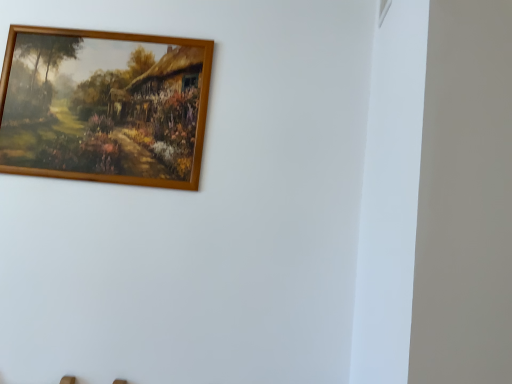
Question: From a real-world perspective, is white plastic window at upper right physically located above or below wooden frame at upper left?

Choices:
 (A) above
 (B) below

Answer: (A)

Question: Is point (381, 3) closer or farther from the camera than point (26, 46)?

Choices:
 (A) farther
 (B) closer

Answer: (B)

Question: Is white plastic window at upper right wider or thinner than wooden frame at upper left?

Choices:
 (A) thin
 (B) wide

Answer: (A)

Question: Considering the positions of wooden frame at upper left and white plastic window at upper right in the image, is wooden frame at upper left bigger or smaller than white plastic window at upper right?

Choices:
 (A) big
 (B) small

Answer: (A)

Question: Is point (53, 59) positioned closer to the camera than point (388, 6)?

Choices:
 (A) farther
 (B) closer

Answer: (A)

Question: Would you say wooden frame at upper left is to the left or to the right of white plastic window at upper right in the picture?

Choices:
 (A) left
 (B) right

Answer: (A)

Question: Is wooden frame at upper left wider or thinner than white plastic window at upper right?

Choices:
 (A) wide
 (B) thin

Answer: (A)